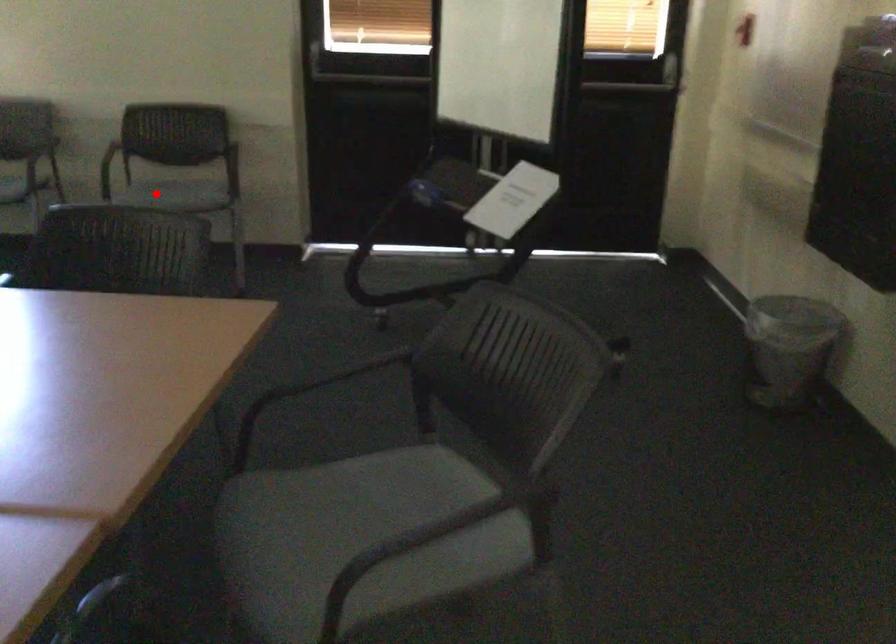
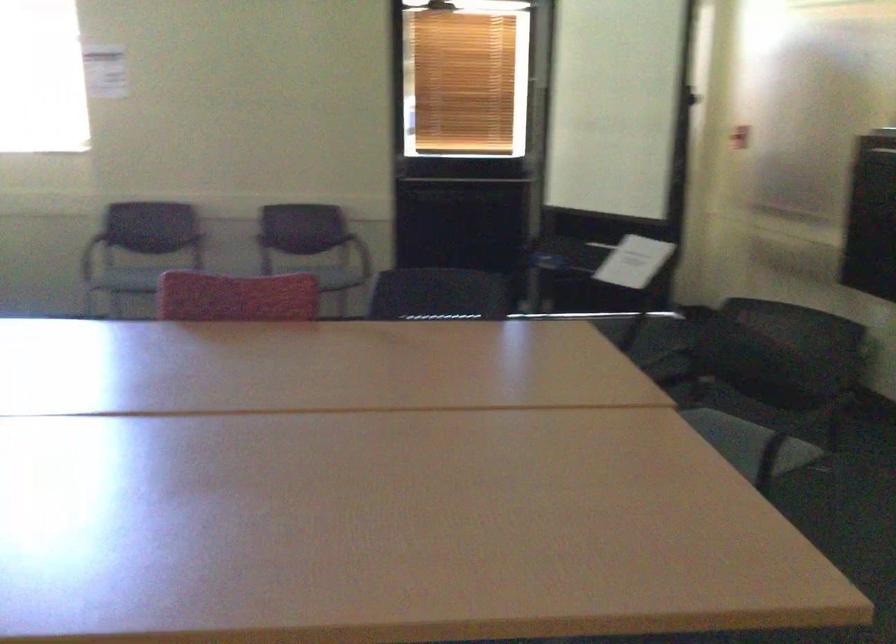
Question: I am providing you with two images of the same scene from different viewpoints. A red point is marked on the first image. Can you still see the location of the red point in image 2?

Choices:
 (A) Yes
 (B) No

Answer: (B)